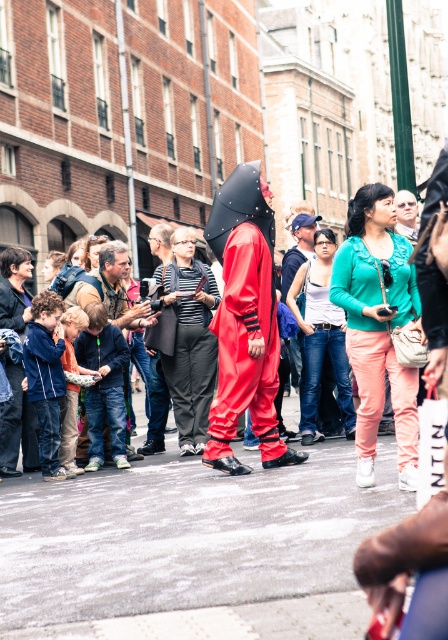
You are standing at the point labeled point (271, 412) and want to move towards the point labeled point (306, 394). Given that both points are on the street in the scene, will you have to walk behind the person in the red costume to reach your destination?

Yes, you will have to walk behind the person in the red costume because point (271, 412) is in front of point (306, 394), meaning the path to the latter is obstructed by the person in the red costume who is positioned between them.

From the picture: You are a photographer trying to capture a photo of the striped fabric jacket at center and the matte red suit at center in the lively street scene. You want to ensure both are in focus. Which object should you adjust your camera focus on first to account for their sizes?

The striped fabric jacket at center is thinner than the matte red suit at center, so you should focus on the matte red suit at center first since it is larger and may require more precise focus to ensure clarity.

Looking at this image, you are a photographer trying to capture the shiny red jumpsuit at center and the matte black umbrella at center in a single frame. Based on their positions, which object should you focus on first to ensure both are in the frame?

The shiny red jumpsuit at center is below the matte black umbrella at center, so you should focus on the matte black umbrella at center first to ensure both objects are captured in the frame.